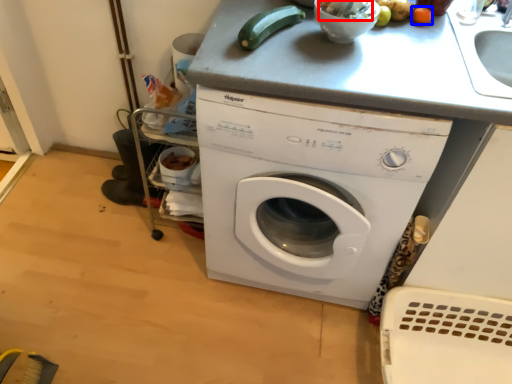
Question: Which of the following is the farthest to the observer, food (highlighted by a red box) or vegetable (highlighted by a blue box)?

Choices:
 (A) food
 (B) vegetable

Answer: (B)